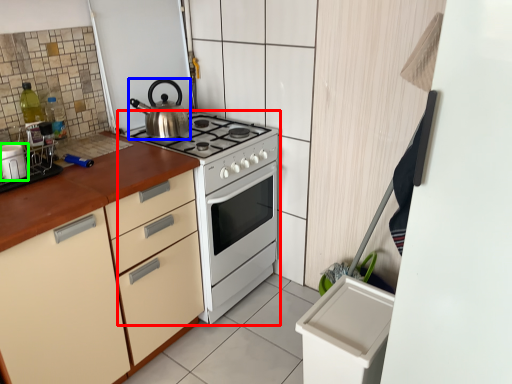
Question: Based on their relative distances, which object is farther from appliance (highlighted by a red box)? Choose from kettle (highlighted by a blue box) and kitchen appliance (highlighted by a green box).

Choices:
 (A) kettle
 (B) kitchen appliance

Answer: (B)